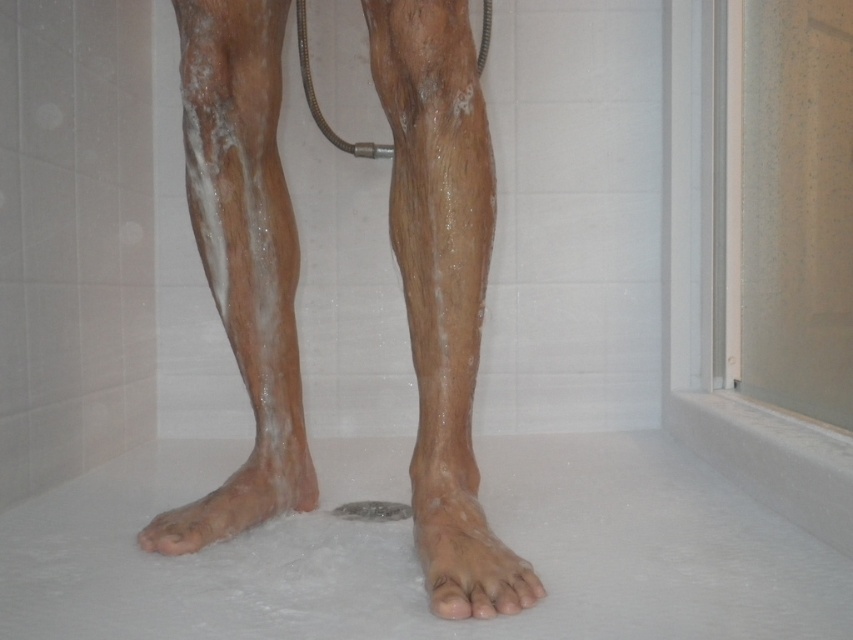
From the picture: You are standing in the shower and need to reach a soap bar located at point [432,595]. There is a slippery tile at point [163,525]. To avoid slipping, you should move around which point first?

You should move around point [163,525] first because point [432,595] is in front of it, meaning the slippery tile is behind your current position. To safely reach the soap bar, avoid stepping on the slippery tile by moving around it first.

You are a bathroom designer assessing the shower layout. You notice two feet in the image, the slightly wet skin foot at lower center and the dry skin foot at lower center. Which foot is closer to the showerhead hose in the background?

The slightly wet skin foot at lower center is closer to the showerhead hose in the background because it is positioned in front of the dry skin foot at lower center.

You are a physical therapist observing a patient in a shower. You notice the slightly wet skin foot at lower center and the dry skin foot at lower center. Which foot is more likely to slip on the shower floor?

The slightly wet skin foot at lower center is more likely to slip on the shower floor because it is positioned under the dry skin foot at lower center, indicating it is in contact with the wet shower floor.